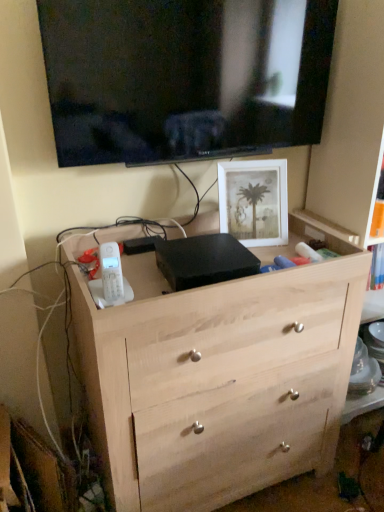
Find the location of a particular element. natural wood chest of drawers at center is located at coordinates (219, 377).

What is the approximate width of natural wood chest of drawers at center?

natural wood chest of drawers at center is 22.36 inches wide.

This screenshot has width=384, height=512. In order to click on black glossy tv at upper center in this screenshot , I will do `click(184, 77)`.

Where is `white matte picture frame at upper right`? white matte picture frame at upper right is located at coordinates (254, 201).

Is white matte picture frame at upper right aimed at black glossy tv at upper center?

No, white matte picture frame at upper right is not facing towards black glossy tv at upper center.

Which object is positioned more to the right, white matte picture frame at upper right or black glossy tv at upper center?

white matte picture frame at upper right is more to the right.

Is white matte picture frame at upper right in front of or behind black glossy tv at upper center in the image?

Clearly, white matte picture frame at upper right is behind black glossy tv at upper center.

From the image's perspective, which object appears higher, black glossy tv at upper center or natural wood chest of drawers at center?

black glossy tv at upper center.

Find the location of `television on the left of natural wood chest of drawers at center`. television on the left of natural wood chest of drawers at center is located at coordinates (184, 77).

Would you say black glossy tv at upper center contains natural wood chest of drawers at center?

Definitely not — natural wood chest of drawers at center is not inside black glossy tv at upper center.

What's the angular difference between black glossy tv at upper center and natural wood chest of drawers at center's facing directions?

The facing directions of black glossy tv at upper center and natural wood chest of drawers at center are 0.326 degrees apart.

From a real-world perspective, is black glossy tv at upper center physically located above or below white matte picture frame at upper right?

From a real-world perspective, black glossy tv at upper center is physically above white matte picture frame at upper right.

Is black glossy tv at upper center to the left of white matte picture frame at upper right from the viewer's perspective?

Yes.

In the scene shown: Does black glossy tv at upper center have a lesser height compared to white matte picture frame at upper right?

No, black glossy tv at upper center is not shorter than white matte picture frame at upper right.

In terms of width, does natural wood chest of drawers at center look wider or thinner when compared to black glossy tv at upper center?

In the image, natural wood chest of drawers at center appears to be wider than black glossy tv at upper center.

What's the angular difference between natural wood chest of drawers at center and black glossy tv at upper center's facing directions?

There is a 0.326-degree angle between the facing directions of natural wood chest of drawers at center and black glossy tv at upper center.

Is natural wood chest of drawers at center not close to black glossy tv at upper center?

natural wood chest of drawers at center is near black glossy tv at upper center, not far away.

From a real-world perspective, which is physically below, natural wood chest of drawers at center or black glossy tv at upper center?

natural wood chest of drawers at center.

Looking at this image, from a real-world perspective, who is located higher, natural wood chest of drawers at center or white matte picture frame at upper right?

In real-world perspective, white matte picture frame at upper right is above.

Is point (309, 352) closer to camera compared to point (231, 174)?

Yes, point (309, 352) is in front of point (231, 174).

Looking at this image, can we say natural wood chest of drawers at center lies outside white matte picture frame at upper right?

Yes, natural wood chest of drawers at center is outside of white matte picture frame at upper right.

Can you confirm if natural wood chest of drawers at center is wider than white matte picture frame at upper right?

Yes, natural wood chest of drawers at center is wider than white matte picture frame at upper right.

Locate an element on the screen. The width and height of the screenshot is (384, 512). picture frame above the natural wood chest of drawers at center (from the image's perspective) is located at coordinates (254, 201).

In terms of size, does white matte picture frame at upper right appear bigger or smaller than natural wood chest of drawers at center?

Clearly, white matte picture frame at upper right is smaller in size than natural wood chest of drawers at center.

From the image's perspective, is white matte picture frame at upper right on top of natural wood chest of drawers at center?

Indeed, from the image's perspective, white matte picture frame at upper right is shown above natural wood chest of drawers at center.

Find the location of a particular element. television above the white matte picture frame at upper right (from the image's perspective) is located at coordinates (184, 77).

There is a natural wood chest of drawers at center. Identify the location of television above it (from a real-world perspective). (184, 77).

Which object lies nearer to the anchor point white matte picture frame at upper right, natural wood chest of drawers at center or black glossy tv at upper center?

black glossy tv at upper center.

From the image, which object appears to be farther from black glossy tv at upper center, natural wood chest of drawers at center or white matte picture frame at upper right?

Based on the image, natural wood chest of drawers at center appears to be further to black glossy tv at upper center.

Based on their spatial positions, is black glossy tv at upper center or natural wood chest of drawers at center closer to white matte picture frame at upper right?

black glossy tv at upper center.

Looking at this image, estimate the real-world distances between objects in this image. Which object is closer to natural wood chest of drawers at center, black glossy tv at upper center or white matte picture frame at upper right?

white matte picture frame at upper right.

Looking at the image, which one is located further to natural wood chest of drawers at center, white matte picture frame at upper right or black glossy tv at upper center?

black glossy tv at upper center.

Looking at the image, which one is located closer to black glossy tv at upper center, white matte picture frame at upper right or natural wood chest of drawers at center?

white matte picture frame at upper right is closer to black glossy tv at upper center.

At what (x,y) coordinates should I click in order to perform the action: click on picture frame that lies between black glossy tv at upper center and natural wood chest of drawers at center from top to bottom. Please return your answer as a coordinate pair (x, y). Looking at the image, I should click on (254, 201).